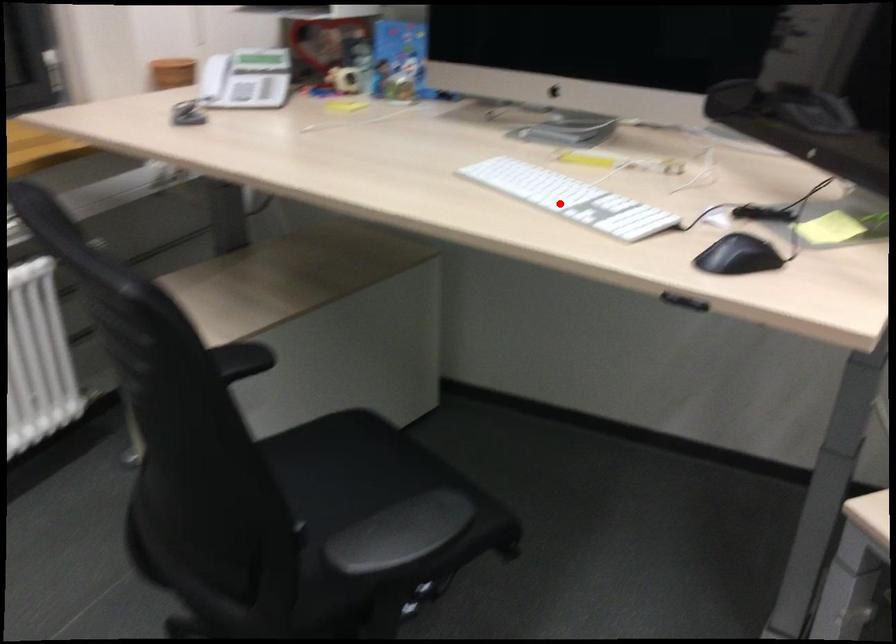
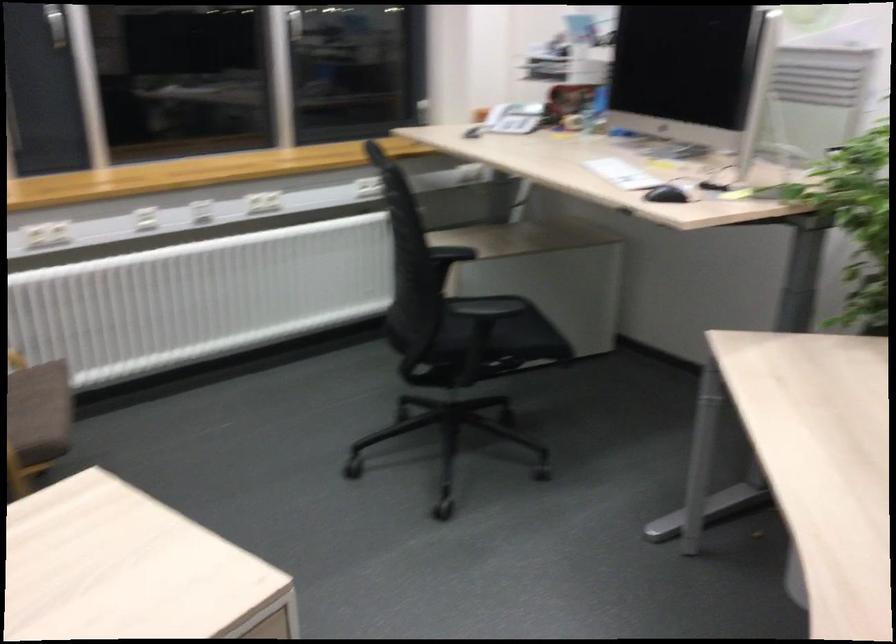
In the second image, find the point that corresponds to the highlighted location in the first image.

(622, 174)